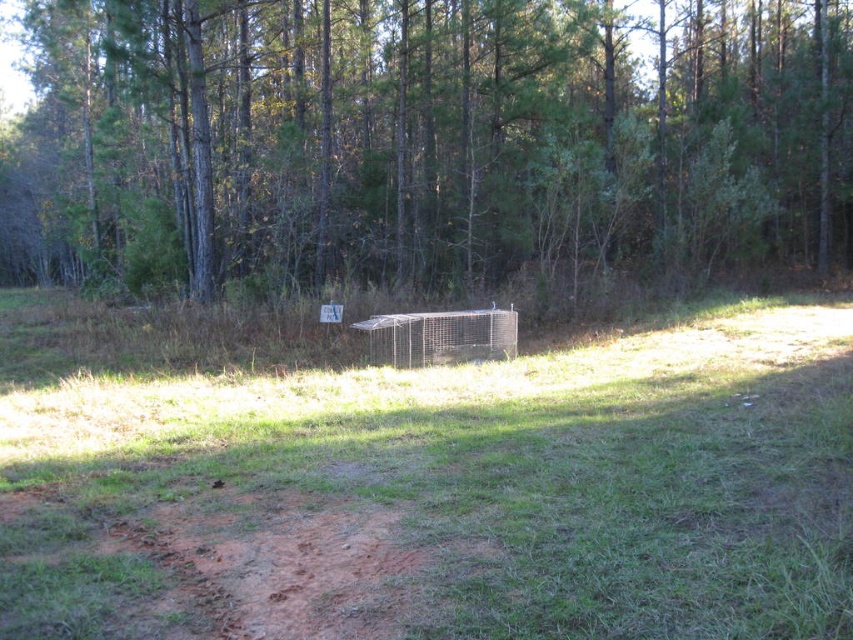
You are a gardener who wants to plant a new flower bed in the rural outdoor scene. The flower bed requires a spot with more open space. Based on the image, which area should you choose between the green grass at center and the brown wood tree at center?

The green grass at center occupies less space than the brown wood tree at center, so the brown wood tree at center has more open space available for planting the flower bed.

You are standing at the starting point of the path in the rural scene. There are two points marked in the image. Which point is closer to you, point (605, 394) or point (265, 202)?

Point (605, 394) is closer to the viewer than point (265, 202).

You are a hiker who wants to walk towards the brown wood tree at center. From your current position, which direction should you move relative to the green grass at center?

Since the green grass at center is to the right of the brown wood tree at center, you should move to the left of the green grass at center to reach the brown wood tree at center.